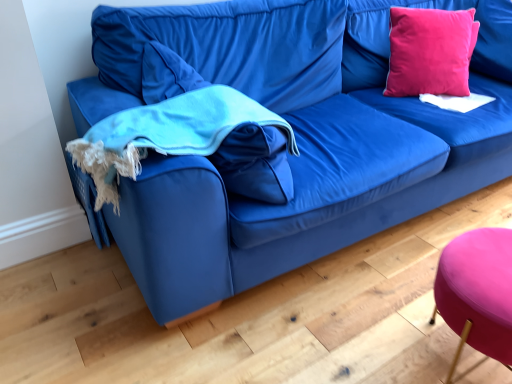
Question: Does turquoise fleece blanket at left have a lesser height compared to pink velvet pillow at upper right?

Choices:
 (A) no
 (B) yes

Answer: (B)

Question: Considering the relative sizes of turquoise fleece blanket at left and pink velvet pillow at upper right in the image provided, is turquoise fleece blanket at left smaller than pink velvet pillow at upper right?

Choices:
 (A) yes
 (B) no

Answer: (B)

Question: Is turquoise fleece blanket at left taller than pink velvet pillow at upper right?

Choices:
 (A) yes
 (B) no

Answer: (B)

Question: From the image's perspective, is turquoise fleece blanket at left located above pink velvet pillow at upper right?

Choices:
 (A) yes
 (B) no

Answer: (B)

Question: Can you confirm if turquoise fleece blanket at left is bigger than pink velvet pillow at upper right?

Choices:
 (A) yes
 (B) no

Answer: (A)

Question: Can you confirm if turquoise fleece blanket at left is wider than pink velvet pillow at upper right?

Choices:
 (A) no
 (B) yes

Answer: (B)

Question: From the image's perspective, is purple fabric stool at lower right located above turquoise fleece blanket at left?

Choices:
 (A) yes
 (B) no

Answer: (B)

Question: Is purple fabric stool at lower right in front of turquoise fleece blanket at left?

Choices:
 (A) no
 (B) yes

Answer: (B)

Question: Considering the relative positions of purple fabric stool at lower right and turquoise fleece blanket at left in the image provided, is purple fabric stool at lower right to the left of turquoise fleece blanket at left from the viewer's perspective?

Choices:
 (A) yes
 (B) no

Answer: (B)

Question: Is purple fabric stool at lower right far from turquoise fleece blanket at left?

Choices:
 (A) no
 (B) yes

Answer: (A)

Question: Does purple fabric stool at lower right have a lesser width compared to turquoise fleece blanket at left?

Choices:
 (A) no
 (B) yes

Answer: (B)

Question: Is purple fabric stool at lower right wider than turquoise fleece blanket at left?

Choices:
 (A) no
 (B) yes

Answer: (A)

Question: Can you confirm if turquoise fleece blanket at left is bigger than purple fabric stool at lower right?

Choices:
 (A) no
 (B) yes

Answer: (B)